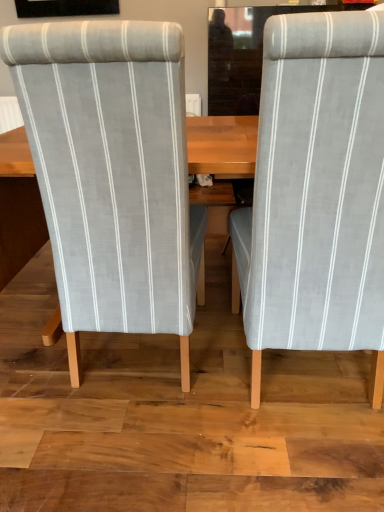
Question: Is gray fabric chair at right, the second chair positioned from the left, looking in the opposite direction of light gray striped fabric chair at left, which appears as the first chair when viewed from the left?

Choices:
 (A) no
 (B) yes

Answer: (A)

Question: Considering the relative positions of gray fabric chair at right, the second chair positioned from the left, and light gray striped fabric chair at left, which appears as the first chair when viewed from the left, in the image provided, is gray fabric chair at right, the second chair positioned from the left, to the left of light gray striped fabric chair at left, which appears as the first chair when viewed from the left, from the viewer's perspective?

Choices:
 (A) yes
 (B) no

Answer: (B)

Question: Can you confirm if gray fabric chair at right, the second chair positioned from the left, is smaller than light gray striped fabric chair at left, which appears as the first chair when viewed from the left?

Choices:
 (A) yes
 (B) no

Answer: (A)

Question: Is gray fabric chair at right, the second chair positioned from the left, facing towards light gray striped fabric chair at left, the second chair from the right?

Choices:
 (A) yes
 (B) no

Answer: (B)

Question: Is gray fabric chair at right, the second chair positioned from the left, bigger than light gray striped fabric chair at left, the second chair from the right?

Choices:
 (A) yes
 (B) no

Answer: (B)

Question: Is gray fabric chair at right, which is the 1th chair in right-to-left order, behind light gray striped fabric chair at left, which appears as the first chair when viewed from the left?

Choices:
 (A) yes
 (B) no

Answer: (B)

Question: Considering the relative positions of light gray striped fabric chair at left, the second chair from the right, and gray fabric chair at right, the second chair positioned from the left, in the image provided, is light gray striped fabric chair at left, the second chair from the right, to the right of gray fabric chair at right, the second chair positioned from the left, from the viewer's perspective?

Choices:
 (A) no
 (B) yes

Answer: (A)

Question: From the image's perspective, is light gray striped fabric chair at left, the second chair from the right, located beneath gray fabric chair at right, the second chair positioned from the left?

Choices:
 (A) no
 (B) yes

Answer: (A)

Question: Is light gray striped fabric chair at left, which appears as the first chair when viewed from the left, in contact with gray fabric chair at right, which is the 1th chair in right-to-left order?

Choices:
 (A) yes
 (B) no

Answer: (B)

Question: Is light gray striped fabric chair at left, the second chair from the right, bigger than gray fabric chair at right, which is the 1th chair in right-to-left order?

Choices:
 (A) no
 (B) yes

Answer: (B)

Question: Could you tell me if light gray striped fabric chair at left, the second chair from the right, is facing gray fabric chair at right, the second chair positioned from the left?

Choices:
 (A) no
 (B) yes

Answer: (A)

Question: Is gray fabric chair at right, which is the 1th chair in right-to-left order, surrounded by light gray striped fabric chair at left, which appears as the first chair when viewed from the left?

Choices:
 (A) yes
 (B) no

Answer: (B)

Question: Considering the positions of gray fabric chair at right, which is the 1th chair in right-to-left order, and light gray striped fabric chair at left, which appears as the first chair when viewed from the left, in the image, is gray fabric chair at right, which is the 1th chair in right-to-left order, bigger or smaller than light gray striped fabric chair at left, which appears as the first chair when viewed from the left,?

Choices:
 (A) big
 (B) small

Answer: (B)